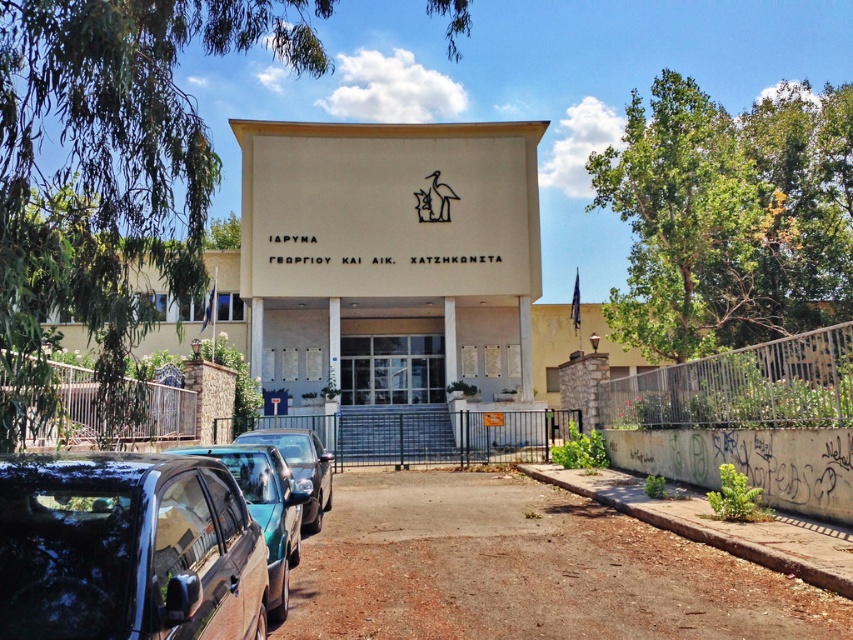
Question: Can you confirm if glossy metallic car at lower left is wider than metallic blue car at lower left?

Choices:
 (A) no
 (B) yes

Answer: (B)

Question: Is the position of satin black car at lower left more distant than that of glossy metallic car at lower left?

Choices:
 (A) yes
 (B) no

Answer: (B)

Question: Which is nearer to the satin black car at lower left?

Choices:
 (A) glossy metallic car at lower left
 (B) metallic blue car at lower left

Answer: (A)

Question: Can you confirm if satin black car at lower left is positioned to the right of metallic blue car at lower left?

Choices:
 (A) no
 (B) yes

Answer: (B)

Question: Which point is closer to the camera?

Choices:
 (A) (292, 481)
 (B) (39, 515)

Answer: (B)

Question: Considering the real-world distances, which object is closest to the satin black car at lower left?

Choices:
 (A) glossy metallic car at lower left
 (B) metallic blue car at lower left

Answer: (A)